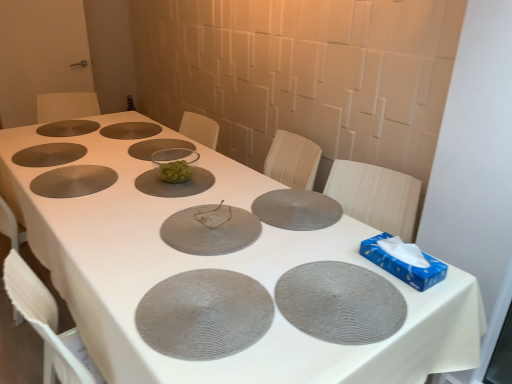
Where is `vacant area in front of green glass bowl at center`? The image size is (512, 384). vacant area in front of green glass bowl at center is located at coordinates (157, 190).